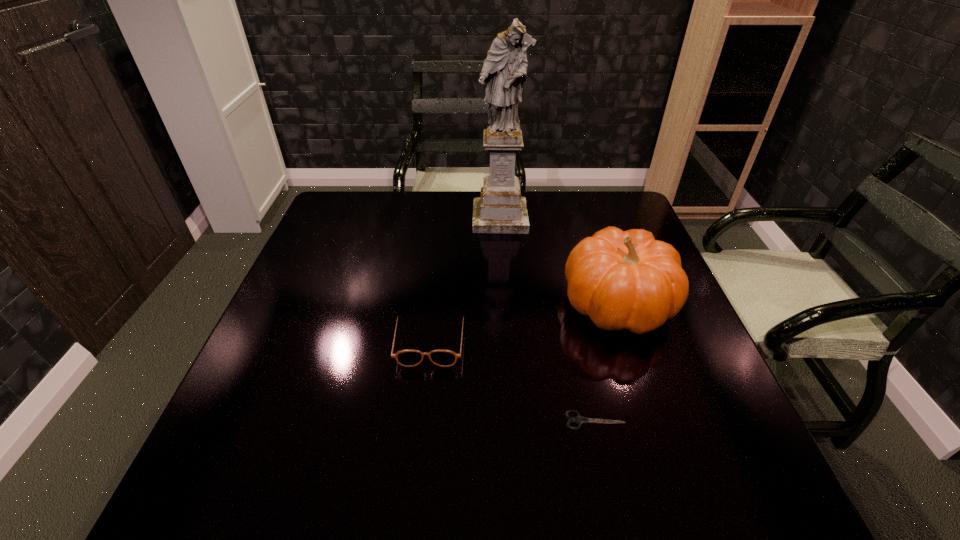
Where is `the second object from left to right`? The image size is (960, 540). the second object from left to right is located at coordinates (500, 209).

Where is `the tallest object`? This screenshot has width=960, height=540. the tallest object is located at coordinates (500, 209).

Locate an element on the screen. This screenshot has height=540, width=960. the third shortest object is located at coordinates (628, 280).

Where is `the third tallest object`? This screenshot has height=540, width=960. the third tallest object is located at coordinates (408, 358).

Identify the location of the leftmost object. (408, 358).

Where is `shears`? The width and height of the screenshot is (960, 540). shears is located at coordinates (579, 419).

At what (x,y) coordinates should I click in order to perform the action: click on the shortest object. Please return your answer as a coordinate pair (x, y). The width and height of the screenshot is (960, 540). Looking at the image, I should click on (579, 419).

Identify the location of blank space located 0.180m on the front-facing side of the sculpture. This screenshot has height=540, width=960. (503, 273).

The image size is (960, 540). In order to click on vacant space located 0.360m on the back of the pumpkin in this screenshot , I will do point(583,199).

This screenshot has width=960, height=540. What are the coordinates of `vacant space located 0.250m on the front-facing side of the sunglasses` in the screenshot? It's located at (414, 487).